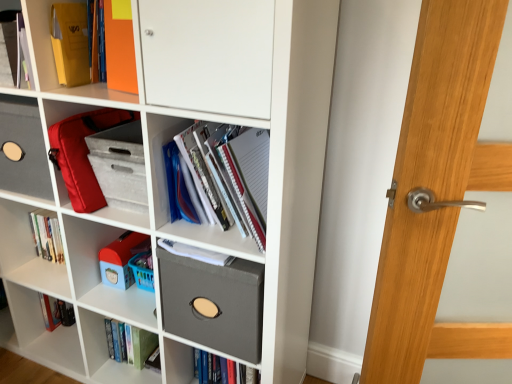
Question: Is matte red bag at center-left, which is counted as the second shelf, starting from the top, smaller than orange matte folder at upper left, the third shelf from the bottom?

Choices:
 (A) no
 (B) yes

Answer: (A)

Question: Is matte red bag at center-left, which is the 2th shelf from left to right, positioned far away from orange matte folder at upper left, placed as the 1th shelf when sorted from top to bottom?

Choices:
 (A) no
 (B) yes

Answer: (A)

Question: Is matte red bag at center-left, which is the second shelf in bottom-to-top order, shorter than orange matte folder at upper left, the third shelf from the bottom?

Choices:
 (A) no
 (B) yes

Answer: (A)

Question: Does matte red bag at center-left, the second shelf in the right-to-left sequence, have a greater width compared to orange matte folder at upper left, placed as the 1th shelf when sorted from top to bottom?

Choices:
 (A) no
 (B) yes

Answer: (A)

Question: Can you confirm if matte red bag at center-left, which is counted as the second shelf, starting from the top, is positioned to the left of orange matte folder at upper left, acting as the 1th shelf starting from the left?

Choices:
 (A) yes
 (B) no

Answer: (B)

Question: From a real-world perspective, is white paper notebook at center, which appears as the first book when viewed from the top, positioned above or below matte red bag at center-left, which is the second shelf in bottom-to-top order?

Choices:
 (A) below
 (B) above

Answer: (B)

Question: Is white paper notebook at center, the 1th book from the right, taller or shorter than matte red bag at center-left, the second shelf in the right-to-left sequence?

Choices:
 (A) tall
 (B) short

Answer: (A)

Question: Is white paper notebook at center, placed as the 2th book when sorted from left to right, to the left or to the right of matte red bag at center-left, which is the second shelf in bottom-to-top order, in the image?

Choices:
 (A) right
 (B) left

Answer: (A)

Question: In the image, is white paper notebook at center, which is the second book from bottom to top, positioned in front of or behind matte red bag at center-left, the second shelf in the right-to-left sequence?

Choices:
 (A) behind
 (B) front

Answer: (B)

Question: Is point (195, 125) closer or farther from the camera than point (125, 233)?

Choices:
 (A) farther
 (B) closer

Answer: (B)

Question: Which is correct: white paper notebook at center, which is the second book from bottom to top, is inside plastic toy at lower left, or outside of it?

Choices:
 (A) inside
 (B) outside

Answer: (B)

Question: From a real-world perspective, is white paper notebook at center, which appears as the first book when viewed from the top, physically located above or below plastic toy at lower left?

Choices:
 (A) below
 (B) above

Answer: (B)

Question: In terms of width, does white paper notebook at center, placed as the 2th book when sorted from left to right, look wider or thinner when compared to plastic toy at lower left?

Choices:
 (A) thin
 (B) wide

Answer: (B)

Question: Is green matte book at lower center, marked as the 1th book in a bottom-to-top arrangement, bigger or smaller than matte gray fabric box at center, the first shelf ordered from the bottom?

Choices:
 (A) small
 (B) big

Answer: (A)

Question: Is point (153, 349) positioned closer to the camera than point (185, 291)?

Choices:
 (A) closer
 (B) farther

Answer: (B)